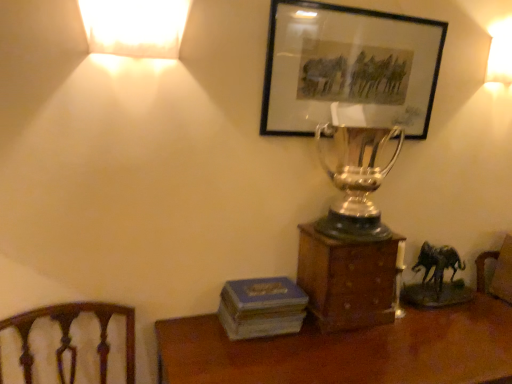
Where is `free space to the left of blue matte book at lower center`? free space to the left of blue matte book at lower center is located at coordinates (198, 336).